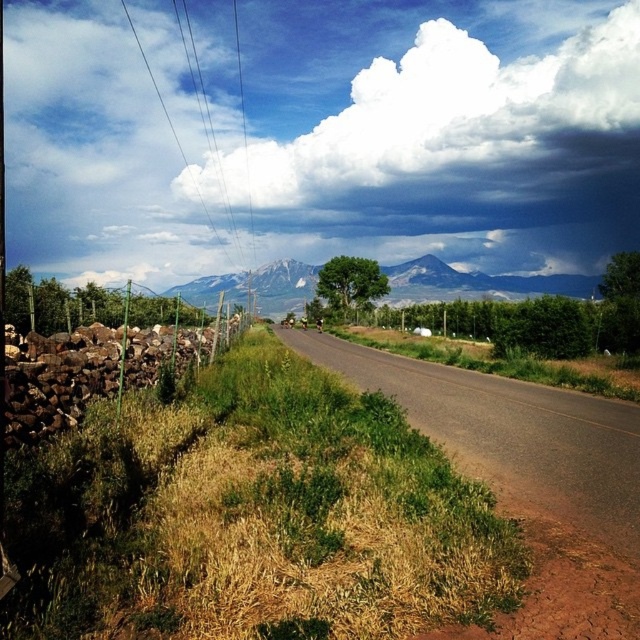
Between white fluffy cloud at upper center and gray rocky mountain at center, which one is positioned lower?

gray rocky mountain at center

Between white fluffy cloud at upper center and gray rocky mountain at center, which one appears on the left side from the viewer's perspective?

gray rocky mountain at center is more to the left.

Does point (522, 61) lie in front of point (275, 301)?

No, it is not.

Where is `white fluffy cloud at upper center`? white fluffy cloud at upper center is located at coordinates (467, 124).